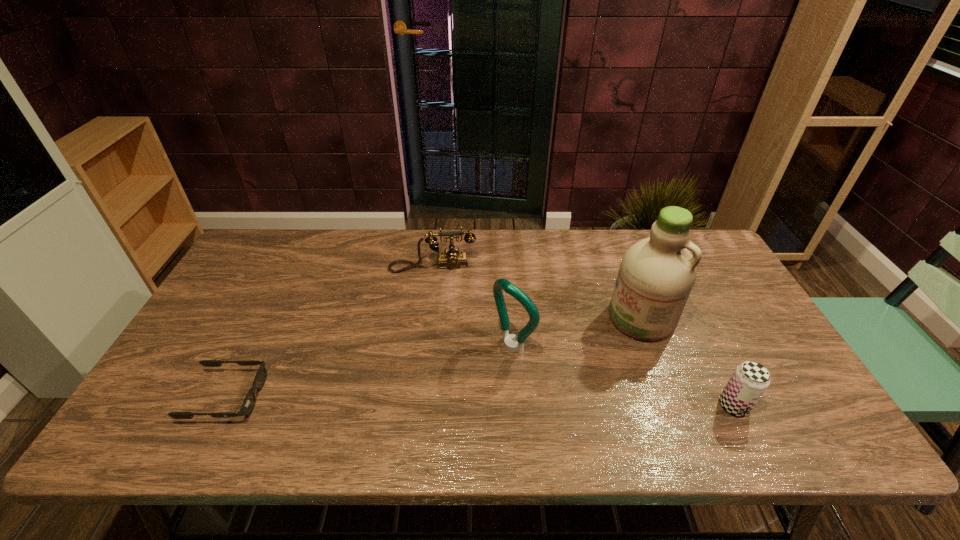
Locate an element on the screen. free location located on the left of the rightmost object is located at coordinates (591, 406).

Image resolution: width=960 pixels, height=540 pixels. I want to click on vacant space located on the front-facing side of the telephone, so click(x=438, y=339).

You are a GUI agent. You are given a task and a screenshot of the screen. Output one action in this format:
    pyautogui.click(x=<x>, y=<y>)
    Task: Click on the vacant space located on the front-facing side of the telephone
    The height and width of the screenshot is (540, 960).
    Given the screenshot: What is the action you would take?
    pyautogui.click(x=437, y=291)

The height and width of the screenshot is (540, 960). I want to click on vacant position located 0.060m on the front-facing side of the telephone, so click(436, 287).

You are a GUI agent. You are given a task and a screenshot of the screen. Output one action in this format:
    pyautogui.click(x=<x>, y=<y>)
    Task: Click on the vacant space located 0.150m at the jaws of the bottle opener
    The image size is (960, 540).
    Given the screenshot: What is the action you would take?
    pyautogui.click(x=453, y=390)

Where is `free space located 0.110m at the jaws of the bottle opener`? This screenshot has width=960, height=540. free space located 0.110m at the jaws of the bottle opener is located at coordinates (466, 381).

Image resolution: width=960 pixels, height=540 pixels. What are the coordinates of `vacant space situated at the jaws of the bottle opener` in the screenshot? It's located at (449, 393).

This screenshot has width=960, height=540. What are the coordinates of `vacant space located on the front label of the tallest object` in the screenshot? It's located at (540, 395).

Where is `vacant space located 0.190m on the front label of the tallest object`? vacant space located 0.190m on the front label of the tallest object is located at coordinates (574, 369).

Locate an element on the screen. The height and width of the screenshot is (540, 960). vacant space located 0.270m on the front label of the tallest object is located at coordinates (552, 386).